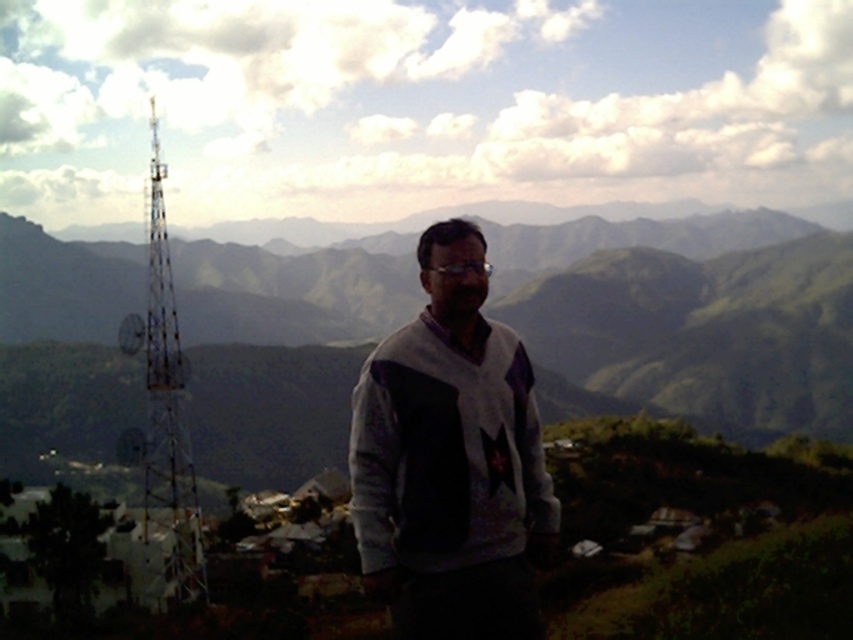
You are a surveyor standing at the base of the telecommunications tower in the image. You need to mark a point that is exactly 400 meters away from your current position. The point must be in the direction of the mountains. Is the point at coordinates point (750, 289) suitable for this purpose?

The point at coordinates point (750, 289) is 403.06 meters away from the viewer, which is slightly more than 400 meters. Therefore, it is not exactly suitable, but close. The surveyor may need to adjust their position slightly backward to reach the exact 400 meter mark.

You are a photographer planning to take a photo of the green grassy mountain at center and the white knitwear at center. Which object should you focus on first if you want both to be in sharp focus?

The green grassy mountain at center should be focused on first because it is closer to the photographer than the white knitwear at center, which is behind it. By focusing on the closer object, the background object may still be in focus depending on the depth of field.